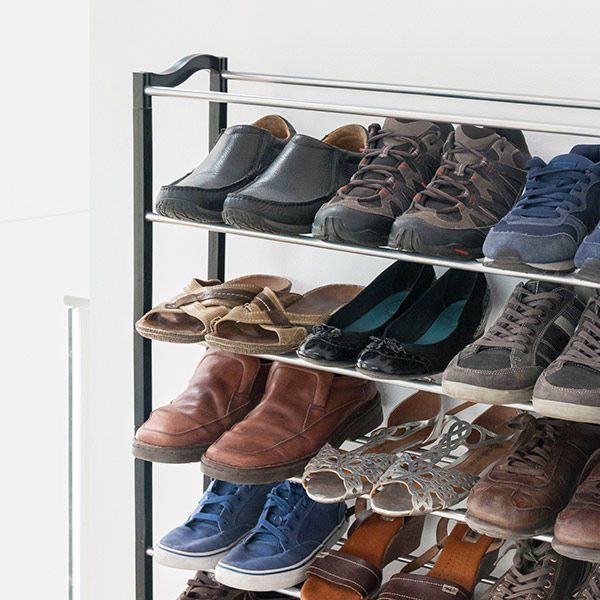
In order to click on shoes third shelf in this screenshot , I will do `click(200, 404)`, `click(273, 432)`, `click(369, 447)`, `click(407, 471)`, `click(499, 481)`, `click(575, 510)`.